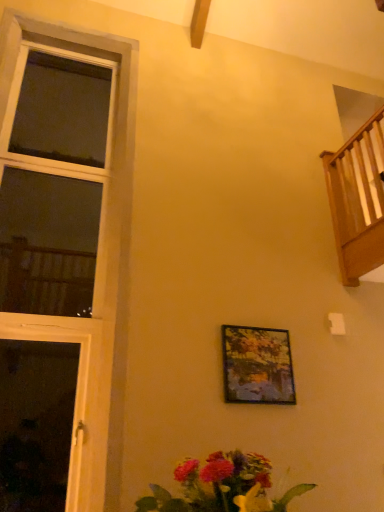
Identify the location of wooden window at left. (98, 250).

The height and width of the screenshot is (512, 384). What do you see at coordinates (222, 486) in the screenshot? I see `vibrant bouquet at lower center` at bounding box center [222, 486].

Measure the distance between metallic gold picture frame at center and camera.

The depth of metallic gold picture frame at center is 2.93 meters.

This screenshot has width=384, height=512. I want to click on wooden window at left, so click(x=98, y=250).

How far apart are vibrant bouquet at lower center and wooden railing at upper right?

They are 8.77 feet apart.

Is point (261, 500) more distant than point (368, 266)?

That is False.

Could you tell me if vibrant bouquet at lower center is turned towards wooden railing at upper right?

No, vibrant bouquet at lower center is not facing towards wooden railing at upper right.

From the image's perspective, is vibrant bouquet at lower center on top of wooden railing at upper right?

No, from the image's perspective, vibrant bouquet at lower center is not over wooden railing at upper right.

Which is closer, (83, 494) or (346, 161)?

The point (83, 494) is closer.

Which of these two, wooden window at left or wooden railing at upper right, is thinner?

wooden window at left is thinner.

Is wooden window at left behind wooden railing at upper right?

No, wooden window at left is closer to the camera.

Based on the photo, which object is further away from the camera, wooden railing at upper right or wooden window at left?

wooden railing at upper right is more distant.

Is wooden railing at upper right facing towards wooden window at left?

Yes.

In the scene shown: Which of these two, wooden railing at upper right or wooden window at left, stands shorter?

With less height is wooden railing at upper right.

From the image's perspective, is wooden railing at upper right located above or below wooden window at left?

Based on their image positions, wooden railing at upper right is located above wooden window at left.

Can you tell me how much metallic gold picture frame at center and wooden railing at upper right differ in facing direction?

The facing directions of metallic gold picture frame at center and wooden railing at upper right are 87.5 degrees apart.

Is metallic gold picture frame at center oriented away from wooden railing at upper right?

No, metallic gold picture frame at center is not facing the opposite direction of wooden railing at upper right.

Which of these two, metallic gold picture frame at center or wooden railing at upper right, is bigger?

wooden railing at upper right.

From the image's perspective, is metallic gold picture frame at center located beneath wooden railing at upper right?

Correct, metallic gold picture frame at center appears lower than wooden railing at upper right in the image.

Is the surface of vibrant bouquet at lower center in direct contact with wooden window at left?

There is a gap between vibrant bouquet at lower center and wooden window at left.

From a real-world perspective, does vibrant bouquet at lower center sit lower than wooden window at left?

Correct, in the physical world, vibrant bouquet at lower center is lower than wooden window at left.

Considering the sizes of objects vibrant bouquet at lower center and wooden window at left in the image provided, who is shorter, vibrant bouquet at lower center or wooden window at left?

Standing shorter between the two is vibrant bouquet at lower center.

Is vibrant bouquet at lower center turned away from wooden window at left?

No, vibrant bouquet at lower center is not facing the opposite direction of wooden window at left.

Can you confirm if wooden window at left is shorter than metallic gold picture frame at center?

In fact, wooden window at left may be taller than metallic gold picture frame at center.

Is wooden window at left smaller than metallic gold picture frame at center?

Actually, wooden window at left might be larger than metallic gold picture frame at center.

Between point (123, 234) and point (261, 362), which one is positioned behind?

Positioned behind is point (123, 234).

Are wooden window at left and metallic gold picture frame at center located far from each other?

They are positioned close to each other.

Is vibrant bouquet at lower center outside of metallic gold picture frame at center?

Absolutely, vibrant bouquet at lower center is external to metallic gold picture frame at center.

Based on their sizes in the image, would you say vibrant bouquet at lower center is bigger or smaller than metallic gold picture frame at center?

In the image, vibrant bouquet at lower center appears to be larger than metallic gold picture frame at center.

From a real-world perspective, is vibrant bouquet at lower center physically located above or below metallic gold picture frame at center?

From a real-world perspective, vibrant bouquet at lower center is physically below metallic gold picture frame at center.

The image size is (384, 512). Find the location of `floral arrangement directly beneath the metallic gold picture frame at center (from a real-world perspective)`. floral arrangement directly beneath the metallic gold picture frame at center (from a real-world perspective) is located at coordinates (222, 486).

In order to click on balcony to the right of vibrant bouquet at lower center in this screenshot , I will do `click(358, 199)`.

Where is `window below the wooden railing at upper right (from the image's perspective)`? This screenshot has height=512, width=384. window below the wooden railing at upper right (from the image's perspective) is located at coordinates (98, 250).

Estimate the real-world distances between objects in this image. Which object is further from wooden window at left, vibrant bouquet at lower center or wooden railing at upper right?

The object further to wooden window at left is wooden railing at upper right.

When comparing their distances from wooden window at left, does metallic gold picture frame at center or wooden railing at upper right seem closer?

metallic gold picture frame at center lies closer to wooden window at left than the other object.

Considering their positions, is wooden railing at upper right positioned further to wooden window at left than vibrant bouquet at lower center?

wooden railing at upper right lies further to wooden window at left than the other object.

From the image, which object appears to be farther from wooden railing at upper right, metallic gold picture frame at center or vibrant bouquet at lower center?

vibrant bouquet at lower center is further to wooden railing at upper right.

From the picture: Based on their spatial positions, is wooden window at left or vibrant bouquet at lower center further from wooden railing at upper right?

The object further to wooden railing at upper right is vibrant bouquet at lower center.

Considering their positions, is wooden railing at upper right positioned closer to vibrant bouquet at lower center than wooden window at left?

wooden window at left is positioned closer to the anchor vibrant bouquet at lower center.

From the image, which object appears to be farther from metallic gold picture frame at center, vibrant bouquet at lower center or wooden railing at upper right?

The object further to metallic gold picture frame at center is vibrant bouquet at lower center.

Considering their positions, is metallic gold picture frame at center positioned further to wooden railing at upper right than wooden window at left?

wooden window at left is positioned further to the anchor wooden railing at upper right.

The width and height of the screenshot is (384, 512). I want to click on balcony between vibrant bouquet at lower center and metallic gold picture frame at center from front to back, so click(358, 199).

Locate an element on the screen. The image size is (384, 512). picture frame between wooden window at left and wooden railing at upper right is located at coordinates (257, 366).

Locate an element on the screen. floral arrangement situated between wooden window at left and wooden railing at upper right from left to right is located at coordinates (222, 486).

Find the location of `window between vibrant bouquet at lower center and metallic gold picture frame at center along the z-axis`. window between vibrant bouquet at lower center and metallic gold picture frame at center along the z-axis is located at coordinates (98, 250).